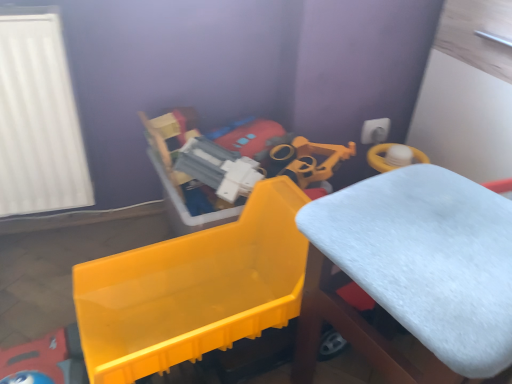
You are a GUI agent. You are given a task and a screenshot of the screen. Output one action in this format:
    pyautogui.click(x=<x>, y=<y>)
    Task: Click on the shiny plastic toy at left
    Image resolution: width=512 pixels, height=384 pixels.
    Given the screenshot: What is the action you would take?
    pyautogui.click(x=193, y=289)

This screenshot has height=384, width=512. Describe the element at coordinates (193, 289) in the screenshot. I see `shiny plastic toy at left` at that location.

Where is `white fluffy cushion at center`? This screenshot has width=512, height=384. white fluffy cushion at center is located at coordinates (414, 272).

In order to face white fluffy cushion at center, should I rotate leftwards or rightwards?

It's best to rotate right around 20.371 degrees.

The width and height of the screenshot is (512, 384). Describe the element at coordinates (414, 272) in the screenshot. I see `white fluffy cushion at center` at that location.

Identify the location of shiny plastic toy at left. (193, 289).

Is shiny plastic toy at left at the right side of white fluffy cushion at center?

Incorrect, shiny plastic toy at left is not on the right side of white fluffy cushion at center.

Which is behind, shiny plastic toy at left or white fluffy cushion at center?

shiny plastic toy at left is more distant.

Is point (197, 273) closer or farther from the camera than point (439, 226)?

Point (197, 273).

From the image's perspective, is shiny plastic toy at left over white fluffy cushion at center?

Yes.

From a real-world perspective, which object rests below the other?

shiny plastic toy at left, from a real-world perspective.

From the picture: Considering the relative sizes of shiny plastic toy at left and white fluffy cushion at center in the image provided, is shiny plastic toy at left thinner than white fluffy cushion at center?

Yes, shiny plastic toy at left is thinner than white fluffy cushion at center.

Who is taller, shiny plastic toy at left or white fluffy cushion at center?

Standing taller between the two is white fluffy cushion at center.

Consider the image. Can you confirm if shiny plastic toy at left is bigger than white fluffy cushion at center?

No.

Do you think shiny plastic toy at left is within white fluffy cushion at center, or outside of it?

shiny plastic toy at left is not inside white fluffy cushion at center, it's outside.

Based on the photo, is the surface of shiny plastic toy at left in direct contact with white fluffy cushion at center?

No, shiny plastic toy at left is not with white fluffy cushion at center.

Is shiny plastic toy at left looking in the opposite direction of white fluffy cushion at center?

No.

Can you tell me how much shiny plastic toy at left and white fluffy cushion at center differ in facing direction?

6.01 degrees separate the facing orientations of shiny plastic toy at left and white fluffy cushion at center.

Locate an element on the screen. Image resolution: width=512 pixels, height=384 pixels. furniture in front of the shiny plastic toy at left is located at coordinates coord(414,272).

Does white fluffy cushion at center appear on the right side of shiny plastic toy at left?

Correct, you'll find white fluffy cushion at center to the right of shiny plastic toy at left.

Is white fluffy cushion at center in front of or behind shiny plastic toy at left in the image?

Clearly, white fluffy cushion at center is in front of shiny plastic toy at left.

Considering the positions of point (364, 192) and point (220, 231), is point (364, 192) closer or farther from the camera than point (220, 231)?

Point (364, 192) is closer to the camera than point (220, 231).

From the image's perspective, would you say white fluffy cushion at center is positioned over shiny plastic toy at left?

No, from the image's perspective, white fluffy cushion at center is not on top of shiny plastic toy at left.

From a real-world perspective, is white fluffy cushion at center on shiny plastic toy at left?

Yes.

Does white fluffy cushion at center have a greater width compared to shiny plastic toy at left?

Yes, white fluffy cushion at center is wider than shiny plastic toy at left.

From the picture: Can you confirm if white fluffy cushion at center is taller than shiny plastic toy at left?

Yes.

Consider the image. Looking at the image, does white fluffy cushion at center seem bigger or smaller compared to shiny plastic toy at left?

Considering their sizes, white fluffy cushion at center takes up more space than shiny plastic toy at left.

Consider the image. Is white fluffy cushion at center surrounding shiny plastic toy at left?

Definitely not — shiny plastic toy at left is not inside white fluffy cushion at center.

Are white fluffy cushion at center and shiny plastic toy at left located far from each other?

That's not correct — white fluffy cushion at center is a little close to shiny plastic toy at left.

Is white fluffy cushion at center aimed at shiny plastic toy at left?

No, white fluffy cushion at center does not turn towards shiny plastic toy at left.

The image size is (512, 384). Identify the location of toy on the left of white fluffy cushion at center. (193, 289).

Identify the location of toy behind the white fluffy cushion at center. (193, 289).

The height and width of the screenshot is (384, 512). What are the coordinates of `toy to the left of white fluffy cushion at center` in the screenshot? It's located at (193, 289).